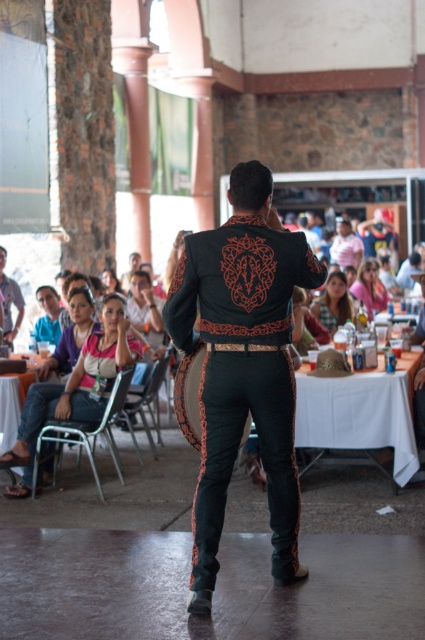
Does point (275, 260) lie behind point (48, 321)?

No, (275, 260) is in front of (48, 321).

Is point (292, 509) more distant than point (51, 301)?

No, it is in front of (51, 301).

Where is `black leather mariachi outfit at center`? The width and height of the screenshot is (425, 640). black leather mariachi outfit at center is located at coordinates (243, 364).

Between point (340, 296) and point (362, 300), which one is positioned behind?

The point (362, 300) is behind.

You are a GUI agent. You are given a task and a screenshot of the screen. Output one action in this format:
    pyautogui.click(x=<x>, y=<y>)
    Task: Click on the matte black dress at center
    The height and width of the screenshot is (640, 425).
    Given the screenshot: What is the action you would take?
    click(333, 301)

Is denim jeans at lower left bigger than metallic gray chair at lower left?

Correct, denim jeans at lower left is larger in size than metallic gray chair at lower left.

Who is more distant from viewer, [91,392] or [91,449]?

Point [91,449]

This screenshot has width=425, height=640. In order to click on denim jeans at lower left in this screenshot , I will do `click(76, 384)`.